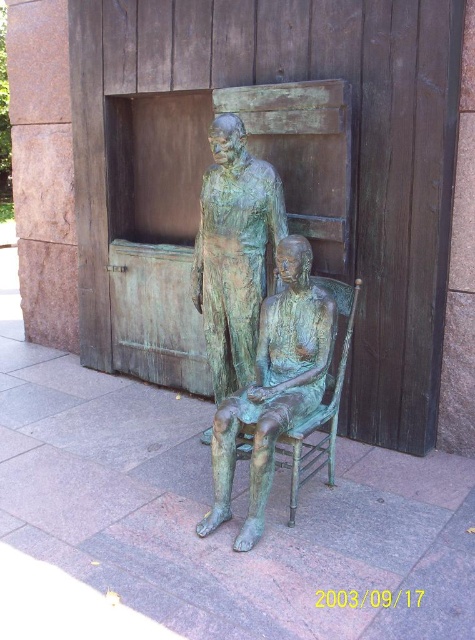
You are a visitor at an outdoor exhibition and see the green patina statue at center and the green patina bronze statue at center. Which one is placed above the other?

The green patina bronze statue at center is placed above the green patina statue at center since it is positioned over it.